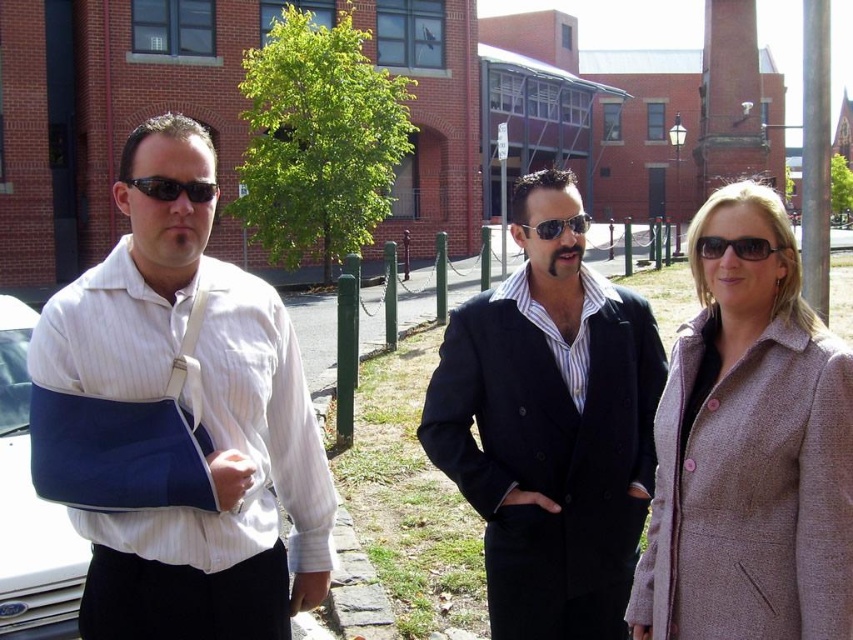
Can you confirm if black wool coat at center is taller than blue fabric arm at left?

Yes, black wool coat at center is taller than blue fabric arm at left.

At what (x,y) coordinates should I click in order to perform the action: click on black wool coat at center. Please return your answer as a coordinate pair (x, y). Looking at the image, I should click on (550, 428).

Is the position of black wool coat at center more distant than that of black plastic sunglasses at center?

Yes, black wool coat at center is behind black plastic sunglasses at center.

Does point (529, 308) come closer to viewer compared to point (200, 184)?

No.

In the scene shown: Who is more forward, (590, 326) or (192, 193)?

Point (192, 193)

This screenshot has width=853, height=640. Identify the location of black wool coat at center. (550, 428).

Between point (677, 348) and point (647, 312), which one is positioned behind?

The point (647, 312) is behind.

Consider the image. Between pink wool coat at center and black wool coat at center, which one is positioned lower?

black wool coat at center

Does point (773, 468) come closer to viewer compared to point (503, 339)?

Yes, it is.

This screenshot has height=640, width=853. In order to click on pink wool coat at center in this screenshot , I will do `click(749, 451)`.